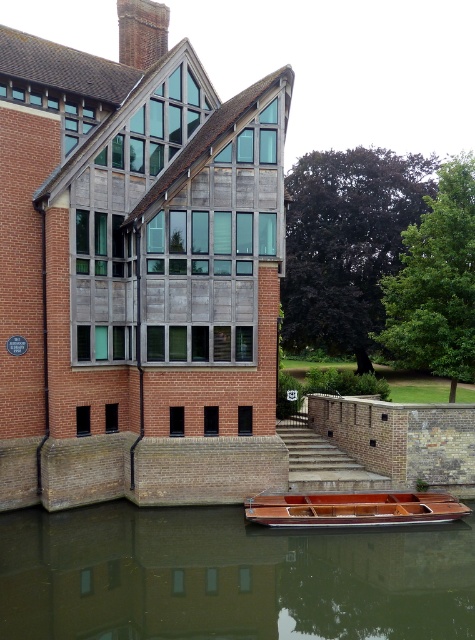
Question: Does brown wooden boat at lower center appear over wooden boat at lower center?

Choices:
 (A) no
 (B) yes

Answer: (A)

Question: Can you confirm if brown wooden boat at lower center is smaller than wooden boat at lower center?

Choices:
 (A) yes
 (B) no

Answer: (B)

Question: Does brown wooden boat at lower center have a larger size compared to wooden boat at lower center?

Choices:
 (A) no
 (B) yes

Answer: (B)

Question: Which of the following is the farthest from the observer?

Choices:
 (A) wooden boat at lower center
 (B) brown wooden boat at lower center

Answer: (A)